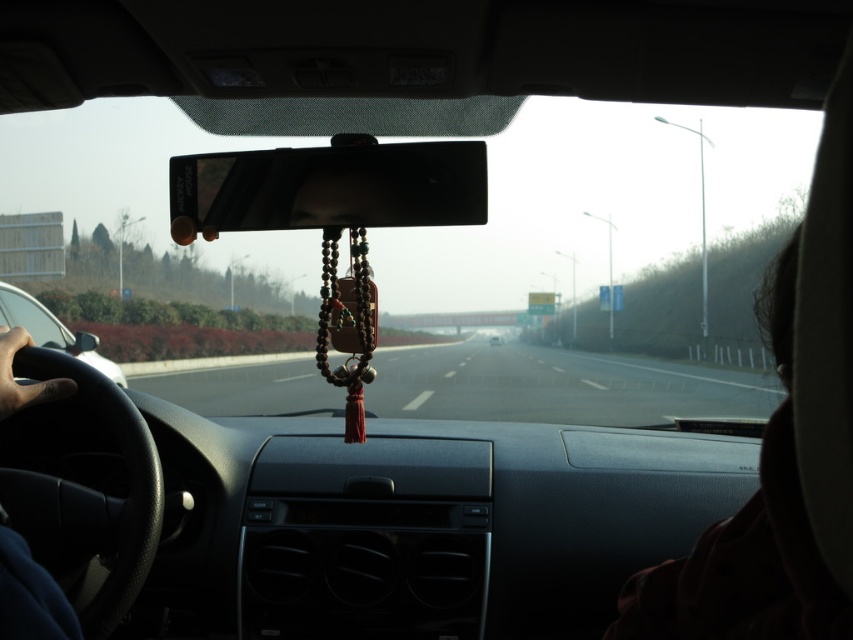
You are a passenger in the car and want to compare the size of the objects you see through the windshield. Which object, the black leather steering wheel at left or the white glossy sedan at center, appears larger in the scene?

The black leather steering wheel at left appears larger than the white glossy sedan at center because it is closer to the viewer.

You are a passenger in the car and want to know if you can see the white glossy sedan at center through the black leather steering wheel at left. Can you?

The black leather steering wheel at left is in front of the white glossy sedan at center, so the steering wheel blocks the view of the sedan from the passenger seat.